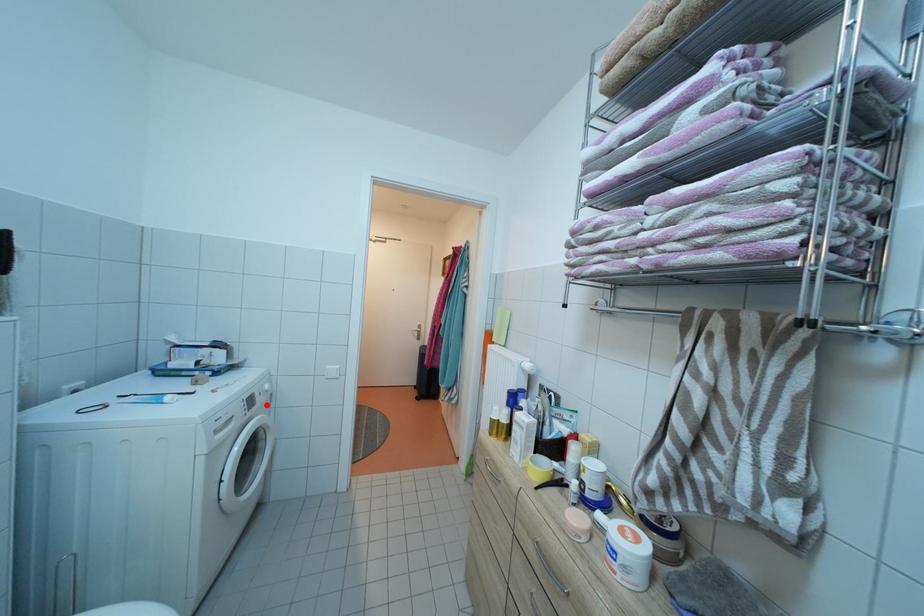
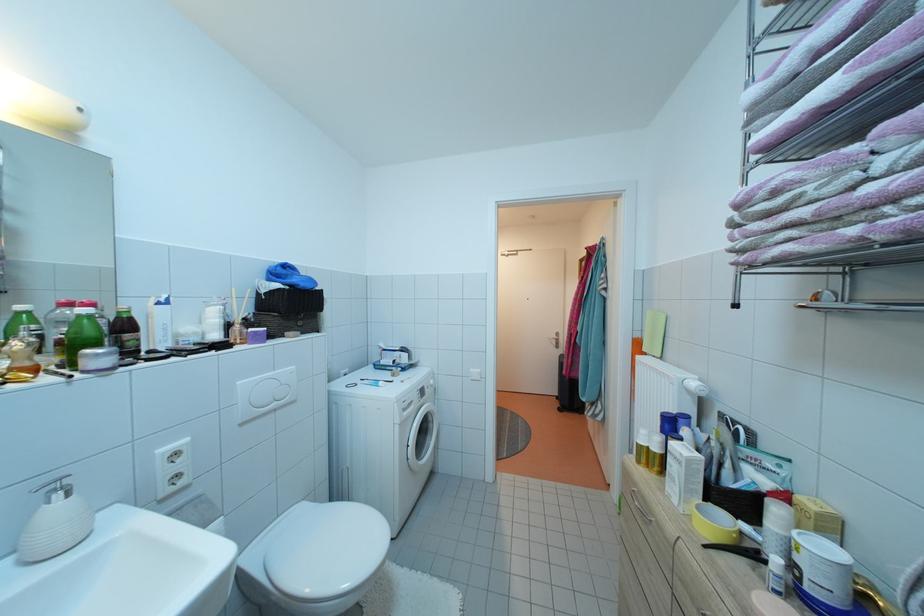
Question: I am providing you with two images of the same scene from different viewpoints. A red point is marked on the first image. At the location where the point appears in image 1, is it still visible in image 2?

Choices:
 (A) Yes
 (B) No

Answer: (A)